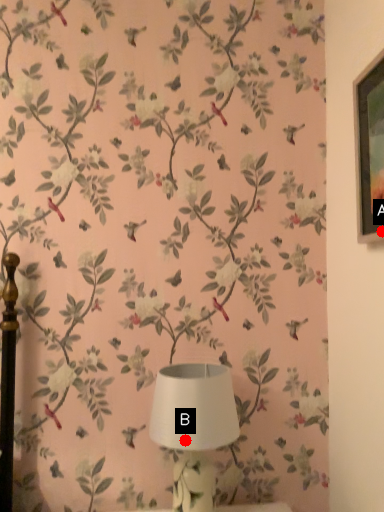
Question: Two points are circled on the image, labeled by A and B beside each circle. Which point is closer to the camera taking this photo?

Choices:
 (A) A is closer
 (B) B is closer

Answer: (A)